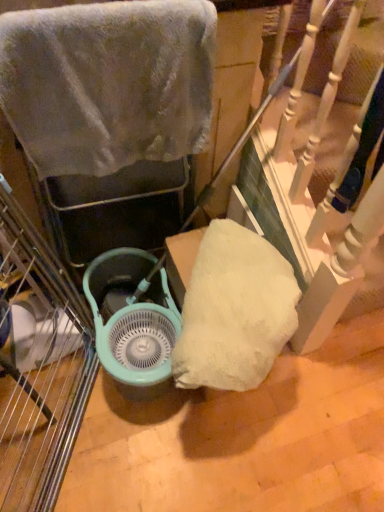
Question: Is the position of teal plastic fan at center less distant than that of fuzzy gray towel at upper left?

Choices:
 (A) yes
 (B) no

Answer: (B)

Question: From a real-world perspective, is teal plastic fan at center physically below fuzzy gray towel at upper left?

Choices:
 (A) yes
 (B) no

Answer: (A)

Question: Considering the relative sizes of teal plastic fan at center and fuzzy gray towel at upper left in the image provided, is teal plastic fan at center smaller than fuzzy gray towel at upper left?

Choices:
 (A) yes
 (B) no

Answer: (B)

Question: Considering the relative sizes of teal plastic fan at center and fuzzy gray towel at upper left in the image provided, is teal plastic fan at center wider than fuzzy gray towel at upper left?

Choices:
 (A) yes
 (B) no

Answer: (A)

Question: From the image's perspective, is teal plastic fan at center beneath fuzzy gray towel at upper left?

Choices:
 (A) yes
 (B) no

Answer: (A)

Question: Is teal plastic fan at center placed right next to fuzzy gray towel at upper left?

Choices:
 (A) no
 (B) yes

Answer: (A)

Question: Does fuzzy gray towel at upper left lie behind teal plastic fan at center?

Choices:
 (A) yes
 (B) no

Answer: (B)

Question: Is fuzzy gray towel at upper left to the left of teal plastic fan at center from the viewer's perspective?

Choices:
 (A) yes
 (B) no

Answer: (B)

Question: Is fuzzy gray towel at upper left in front of teal plastic fan at center?

Choices:
 (A) no
 (B) yes

Answer: (B)

Question: From a real-world perspective, is fuzzy gray towel at upper left under teal plastic fan at center?

Choices:
 (A) yes
 (B) no

Answer: (B)

Question: Would you consider fuzzy gray towel at upper left to be distant from teal plastic fan at center?

Choices:
 (A) yes
 (B) no

Answer: (B)

Question: Can you confirm if fuzzy gray towel at upper left is bigger than teal plastic fan at center?

Choices:
 (A) no
 (B) yes

Answer: (A)

Question: Considering the relative positions of fuzzy gray towel at upper left and teal plastic fan at center in the image provided, is fuzzy gray towel at upper left to the left or to the right of teal plastic fan at center?

Choices:
 (A) left
 (B) right

Answer: (B)